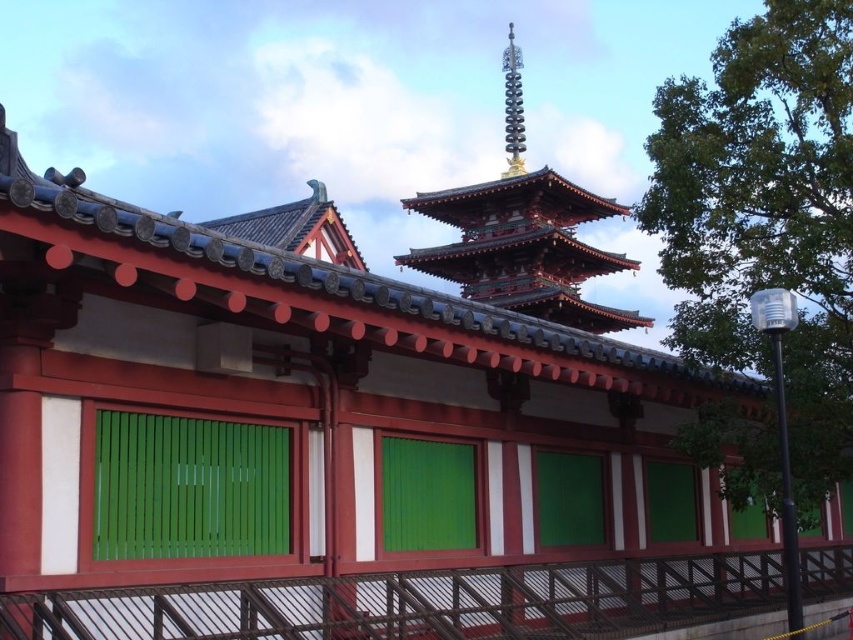
From the picture: You are standing at the camera position and want to take a photo of the shiny gold pagoda at upper center. The camera has a maximum zoom range of 50 meters. Can you capture the pagoda without moving closer?

Answer: The shiny gold pagoda at upper center and camera are 51.84 meters apart from each other. Since the camera can only zoom up to 50 meters, you cannot capture the pagoda without moving closer.

You are standing in front of the traditional Japanese temple or shrine. You notice two points marked on the structure. The first point is at coordinate point (x=131, y=499) and the second point is at coordinate point (x=502, y=264). Which of these two points is closer to your current position?

Point (x=131, y=499) is in front of point (x=502, y=264), so it is closer to your current position.